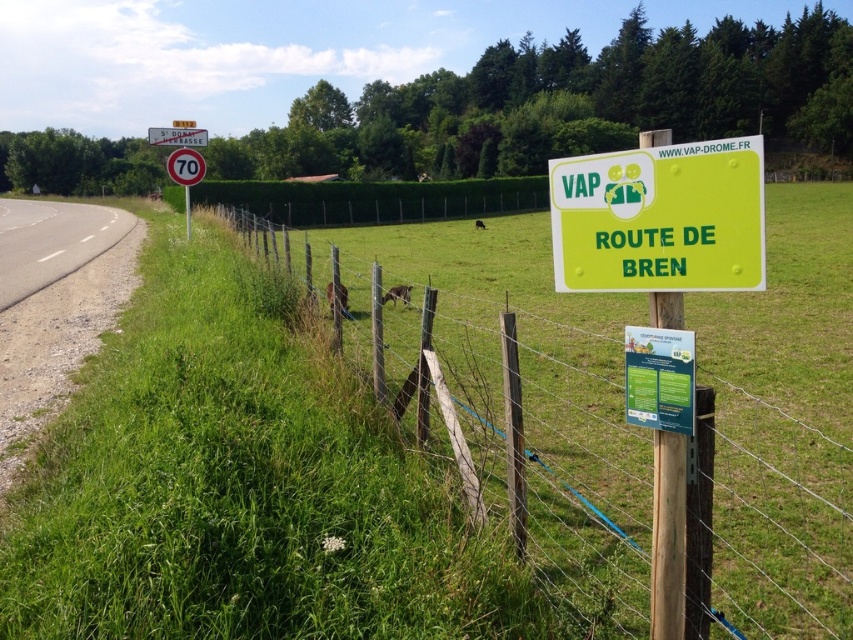
You are standing at the point with coordinates point (751, 284) and want to walk towards the point (193, 132). Which direction should you face to move towards it?

Since point (751, 284) is closer to the viewer than point (193, 132), you should face away from the viewer to move towards point (193, 132).